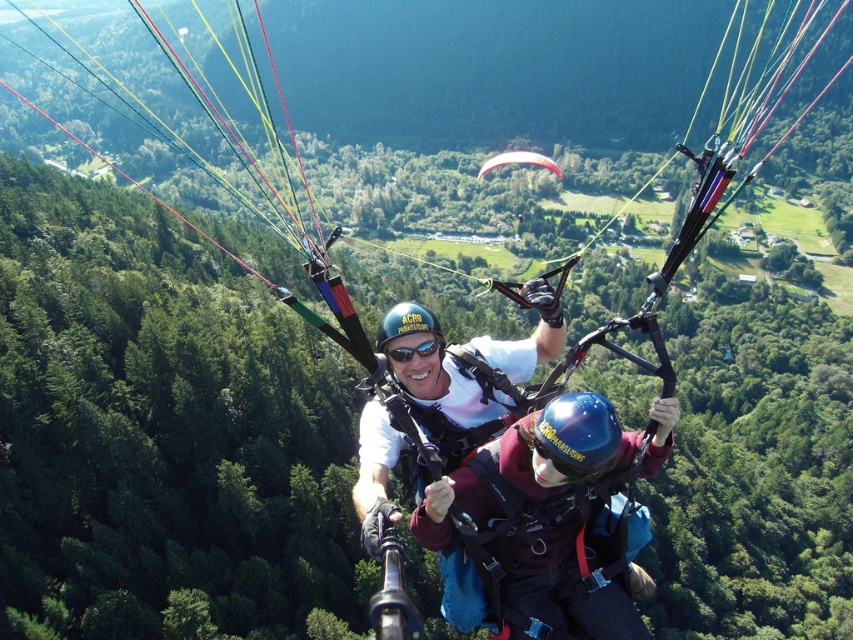
You are a safety inspector reviewing the paragliding setup. You notice the maroon fleece jacket at center and the red nylon parachute at center. Which object is shorter in height?

The maroon fleece jacket at center is shorter than the red nylon parachute at center.

You are a safety inspector checking the equipment of the paragliding duo. You notice the red nylon parachute at center and the black matte goggles at center. Which piece of equipment is bigger in size?

The red nylon parachute at center is larger in size than the black matte goggles at center.